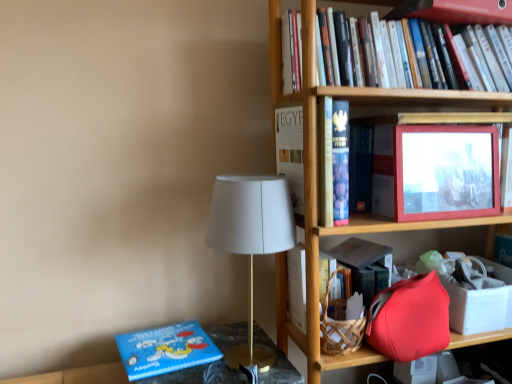
Question: Choose the correct answer: Is matte red picture frame at upper right inside white matte box at right or outside it?

Choices:
 (A) outside
 (B) inside

Answer: (A)

Question: From a real-world perspective, is matte red picture frame at upper right physically located above or below white matte box at right?

Choices:
 (A) below
 (B) above

Answer: (B)

Question: Considering the real-world distances, which object is closest to the blue matte board book at lower left, positioned as the first book in bottom-to-top order?

Choices:
 (A) hardcover book at upper right, the first book when ordered from right to left
 (B) matte red picture frame at upper right
 (C) matte red shoulder bag at lower right
 (D) hardcover book at center
 (E) white matte table lamp at center

Answer: (E)

Question: Which object is positioned closest to the blue matte board book at lower left, which is the second book in top-to-bottom order?

Choices:
 (A) white matte table lamp at center
 (B) hardcover book at center
 (C) matte red picture frame at upper right
 (D) hardcover book at upper right, the first book when ordered from right to left
 (E) matte red shoulder bag at lower right

Answer: (A)